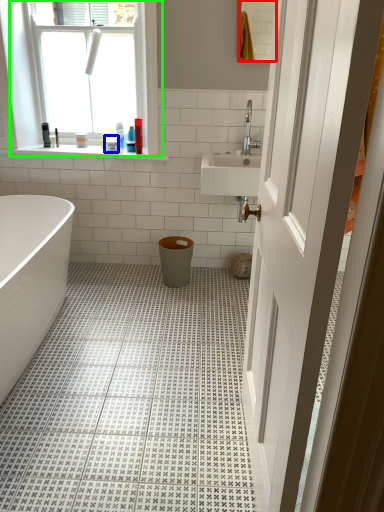
Question: Estimate the real-world distances between objects in this image. Which object is closer to mirror (highlighted by a red box), toiletry (highlighted by a blue box) or window (highlighted by a green box)?

Choices:
 (A) toiletry
 (B) window

Answer: (B)